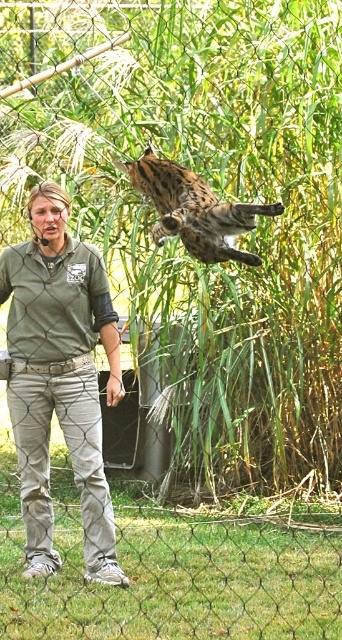
Question: Can you confirm if gray cotton shirt at center is positioned to the right of spotted fur cheetah at upper center?

Choices:
 (A) no
 (B) yes

Answer: (A)

Question: Which of the following is the farthest from the observer?

Choices:
 (A) spotted fur cheetah at upper center
 (B) gray cotton shirt at center

Answer: (B)

Question: Does gray cotton shirt at center have a larger size compared to spotted fur cheetah at upper center?

Choices:
 (A) no
 (B) yes

Answer: (B)

Question: Does gray cotton shirt at center come behind spotted fur cheetah at upper center?

Choices:
 (A) yes
 (B) no

Answer: (A)